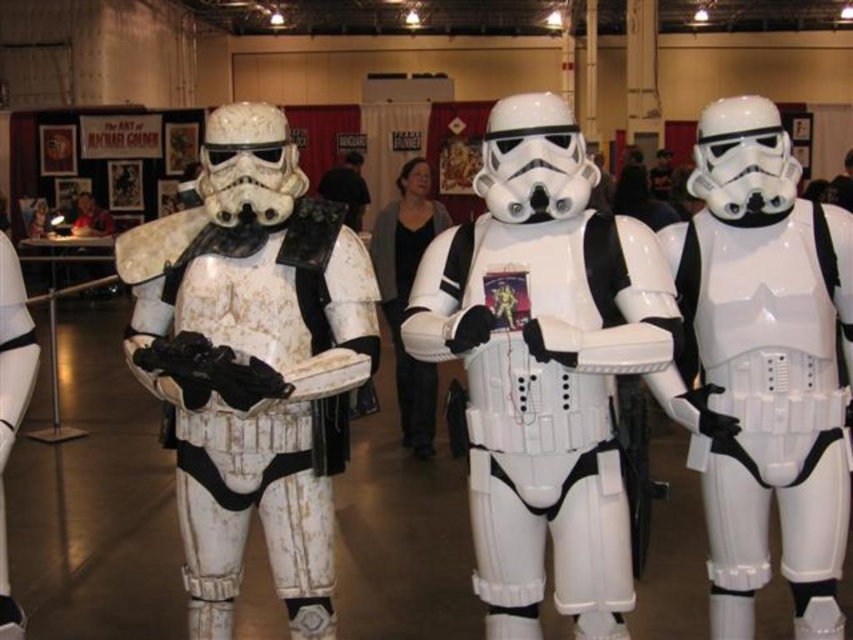
You are a photographer trying to capture a clear shot of both the white glossy stormtrooper at center and the matte white helmet at center. Given that your camera has a depth of field that can focus on objects within a 10 meter range, will both subjects be in focus?

The white glossy stormtrooper at center is 10.52 meters away from the matte white helmet at center. Since the distance between them exceeds the camera lens depth of field range of 10 meters, both subjects cannot be in focus simultaneously.

You are a photographer at a Star Wars convention. You need to take a photo of the white matte stormtrooper armor at center and the white matte helmet at center so that both are clearly visible. Can you position yourself in a way that both objects are fully visible without any obstruction?

The white matte stormtrooper armor at center is in front of the white matte helmet at center, so positioning yourself at an angle where you can see around the stormtrooper armor at center would allow both to be visible without obstruction.

You are a photographer at a Star Wars convention. You want to take a photo of the white matte stormtrooper armor at center. Where should you position your camera to capture it in the best possible way?

The white matte stormtrooper armor at center is located at point (254, 364). Position your camera directly facing this coordinate to ensure the armor is centered and in focus.